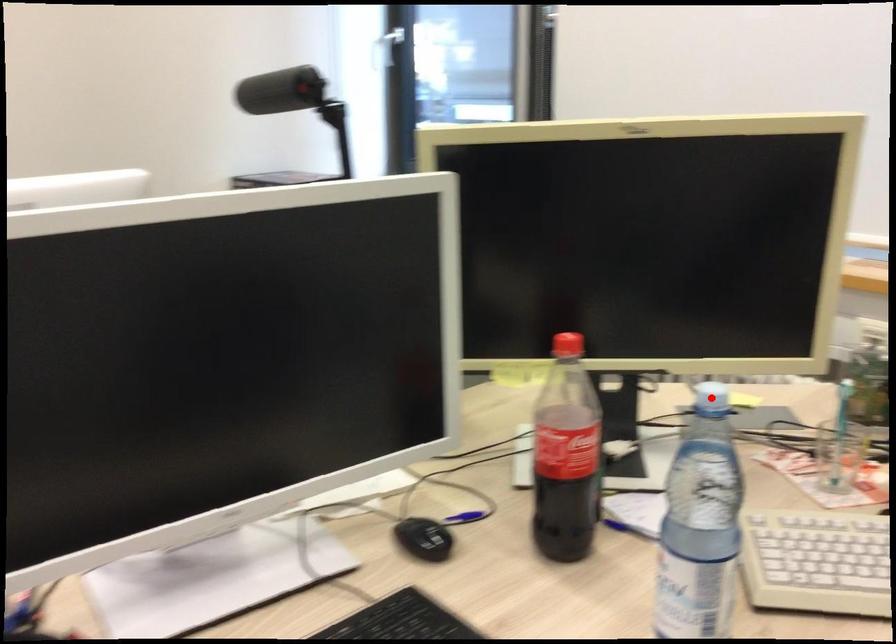
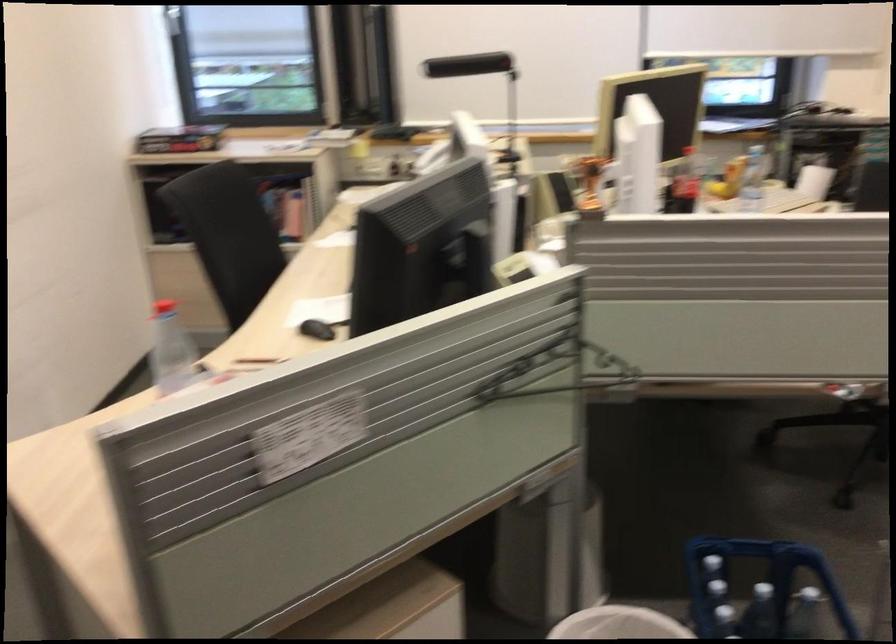
Find the pixel in the second image that matches the highlighted location in the first image.

(746, 143)